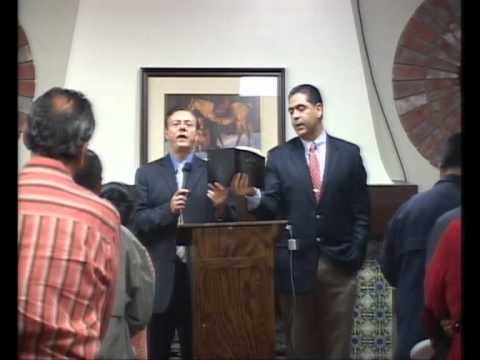
Locate an element on the screen. The width and height of the screenshot is (480, 360). book is located at coordinates (228, 157).